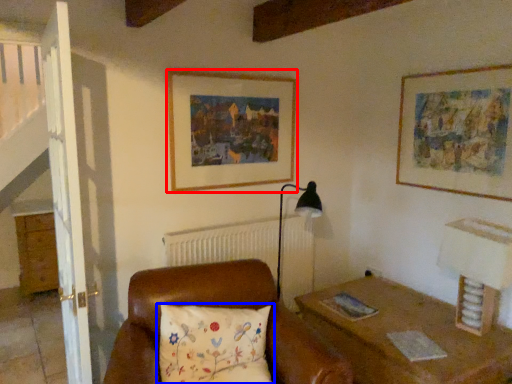
Question: Which of the following is the closest to the observer, picture frame (highlighted by a red box) or pillow (highlighted by a blue box)?

Choices:
 (A) picture frame
 (B) pillow

Answer: (B)